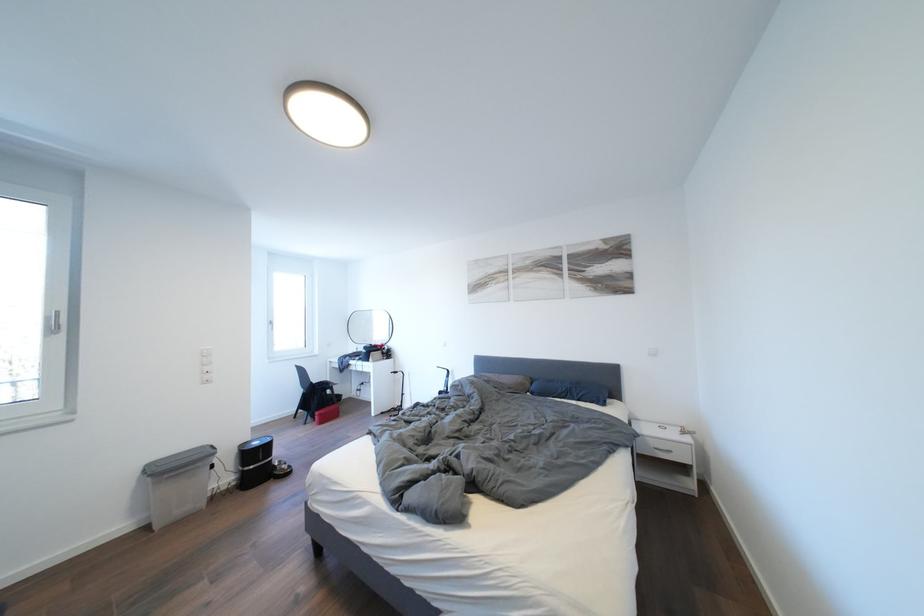
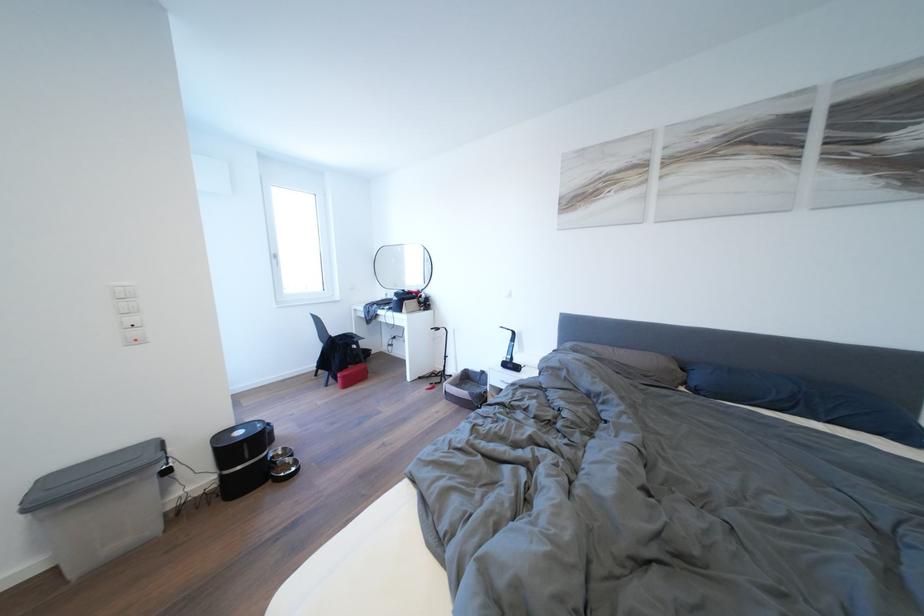
Which direction would the cameraman need to move to produce the second image?

The cameraman moved toward left, forward.